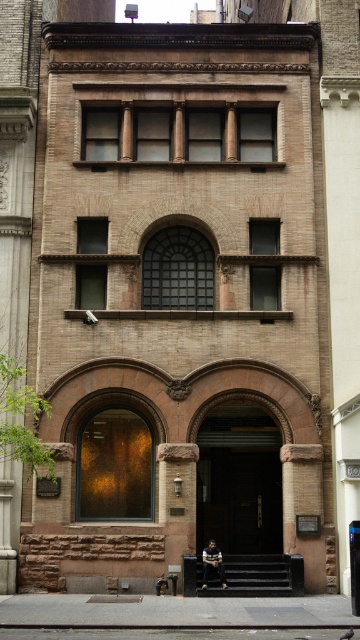
You are standing in front of the building and want to sit down. There is a wooden park bench at lower center and a brown stone door at center. Which object is closer to the ground?

The wooden park bench at lower center is closer to the ground because the brown stone door at center is above it.

You are standing in front of the building and want to enter through the door. The wooden park bench at center is blocking your path. Can you walk around the bench to reach the brown stone door at center?

The brown stone door at center is taller than the wooden park bench at center, so you can walk around the bench and reach the door since the height difference does not block the path.